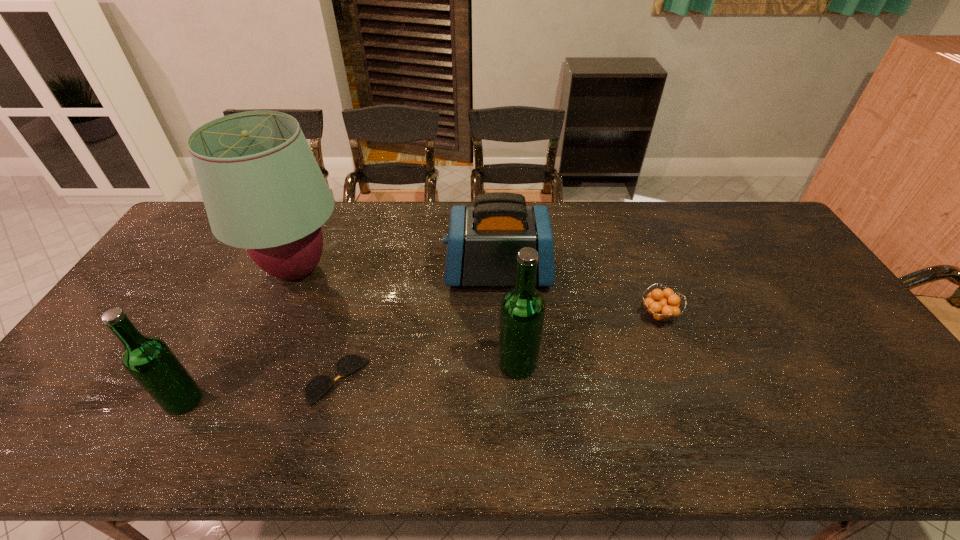
Identify the location of free space between the orange fruit and the shorter beer bottle. (420, 357).

Identify the location of vacant area that lies between the tallest object and the orange fruit. The height and width of the screenshot is (540, 960). (477, 293).

You are a GUI agent. You are given a task and a screenshot of the screen. Output one action in this format:
    pyautogui.click(x=<x>, y=<y>)
    Task: Click on the free area in between the spectacles and the right beer bottle
    The width and height of the screenshot is (960, 540).
    Given the screenshot: What is the action you would take?
    pyautogui.click(x=427, y=372)

Where is `vacant point located between the taller beer bottle and the orange fruit`? vacant point located between the taller beer bottle and the orange fruit is located at coordinates (588, 339).

Identify the location of object that is the third closest one to the lampshade. (483, 242).

Where is `object that is the fourth closest one to the nearer beer bottle`? This screenshot has height=540, width=960. object that is the fourth closest one to the nearer beer bottle is located at coordinates (522, 313).

In order to click on free region that satisfies the following two spatial constraints: 1. on the front-facing side of the second tallest object; 2. on the left side of the toaster in this screenshot , I will do `click(502, 363)`.

I want to click on vacant region that satisfies the following two spatial constraints: 1. on the front-facing side of the third shortest object; 2. on the front side of the shortest object, so click(x=503, y=380).

Where is `blank area in the image that satisfies the following two spatial constraints: 1. on the front-facing side of the second tallest object; 2. on the right side of the third shortest object`? The width and height of the screenshot is (960, 540). blank area in the image that satisfies the following two spatial constraints: 1. on the front-facing side of the second tallest object; 2. on the right side of the third shortest object is located at coordinates (502, 363).

Identify the location of free space that satisfies the following two spatial constraints: 1. on the front-facing side of the fifth shortest object; 2. on the right side of the third shortest object. (502, 363).